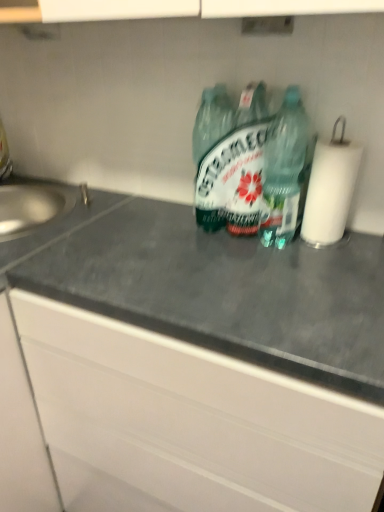
Locate an element on the screen. Image resolution: width=384 pixels, height=512 pixels. vacant area situated to the left side of green glass bottle at center, which is the second bottle in right-to-left order is located at coordinates (165, 226).